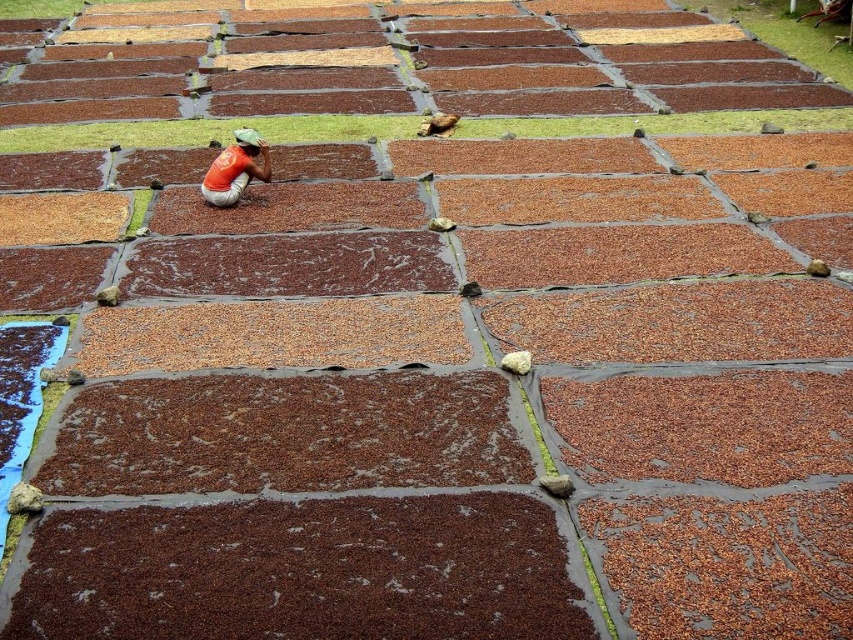
You are standing at the edge of the field looking towards the center. Which object, the brown rough mud at bottom or the orange fabric at center, is closer to your viewpoint?

The orange fabric at center is closer to your viewpoint because it is taller than the brown rough mud at bottom, meaning it occupies a higher position in the visual field.

You are a farmer standing at the edge of the drying area. You notice the brown rough mud at bottom and the orange fabric at center. Which one has a greater width?

The brown rough mud at bottom has a greater width than the orange fabric at center.